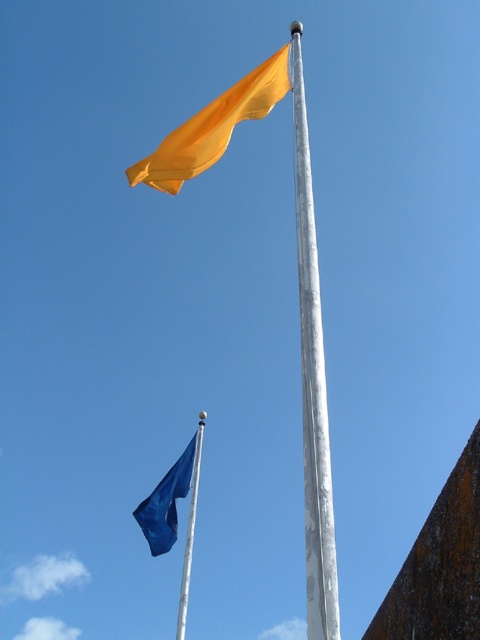
You are a bird perched on a branch observing the two flagpoles. Which object, the silver metallic pole at center or the matte yellow flag at upper center, would you need to fly higher to reach?

The silver metallic pole at center is larger in size compared to the matte yellow flag at upper center, so the bird would need to fly higher to reach the silver metallic pole at center.

Looking at this image, you are standing in front of the two flagpoles and want to take a photo. You notice two specific points marked on the flagpoles. Which point, point (326,509) or point (272,84), will appear larger in your camera view?

Point (326,509) will appear larger in the camera view because it is closer to the camera than point (272,84).